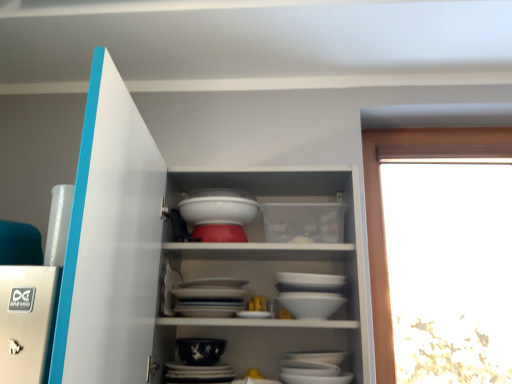
Question: Is dark blue porcelain bowl at center closer to camera compared to white glossy cupboard at center?

Choices:
 (A) no
 (B) yes

Answer: (A)

Question: From the image's perspective, is dark blue porcelain bowl at center over white glossy cupboard at center?

Choices:
 (A) yes
 (B) no

Answer: (B)

Question: Is dark blue porcelain bowl at center thinner than white glossy cupboard at center?

Choices:
 (A) no
 (B) yes

Answer: (B)

Question: Considering the relative sizes of dark blue porcelain bowl at center and white glossy cupboard at center in the image provided, is dark blue porcelain bowl at center shorter than white glossy cupboard at center?

Choices:
 (A) yes
 (B) no

Answer: (A)

Question: From the image's perspective, is dark blue porcelain bowl at center located beneath white glossy cupboard at center?

Choices:
 (A) yes
 (B) no

Answer: (A)

Question: From a real-world perspective, relative to dark blue porcelain bowl at center, is white glossy cupboard at center vertically above or below?

Choices:
 (A) above
 (B) below

Answer: (A)

Question: Considering the positions of white glossy cupboard at center and dark blue porcelain bowl at center in the image, is white glossy cupboard at center taller or shorter than dark blue porcelain bowl at center?

Choices:
 (A) tall
 (B) short

Answer: (A)

Question: Is white glossy cupboard at center wider or thinner than dark blue porcelain bowl at center?

Choices:
 (A) wide
 (B) thin

Answer: (A)

Question: From the image's perspective, relative to dark blue porcelain bowl at center, is white glossy cupboard at center above or below?

Choices:
 (A) below
 (B) above

Answer: (B)

Question: Looking at their shapes, would you say white glossy bowl at center is wider or thinner than dark blue porcelain bowl at center?

Choices:
 (A) thin
 (B) wide

Answer: (B)

Question: Do you think white glossy bowl at center is within dark blue porcelain bowl at center, or outside of it?

Choices:
 (A) outside
 (B) inside

Answer: (A)

Question: From their relative heights in the image, would you say white glossy bowl at center is taller or shorter than dark blue porcelain bowl at center?

Choices:
 (A) tall
 (B) short

Answer: (A)

Question: Considering the positions of white glossy bowl at center and dark blue porcelain bowl at center in the image, is white glossy bowl at center bigger or smaller than dark blue porcelain bowl at center?

Choices:
 (A) small
 (B) big

Answer: (B)

Question: Considering the positions of dark blue porcelain bowl at center and white glossy cupboard at center in the image, is dark blue porcelain bowl at center taller or shorter than white glossy cupboard at center?

Choices:
 (A) short
 (B) tall

Answer: (A)

Question: Is dark blue porcelain bowl at center in front of or behind white glossy cupboard at center in the image?

Choices:
 (A) front
 (B) behind

Answer: (B)